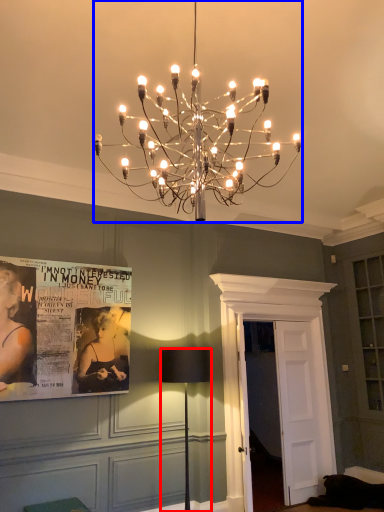
Question: Which object appears closest to the camera in this image, lamp (highlighted by a red box) or lamp (highlighted by a blue box)?

Choices:
 (A) lamp
 (B) lamp

Answer: (B)